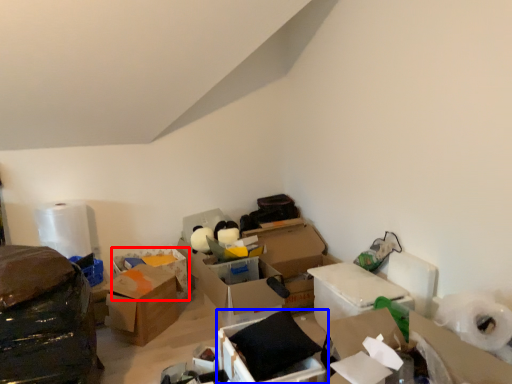
Question: Which object appears closest to the camera in this image, box (highlighted by a red box) or box (highlighted by a blue box)?

Choices:
 (A) box
 (B) box

Answer: (B)